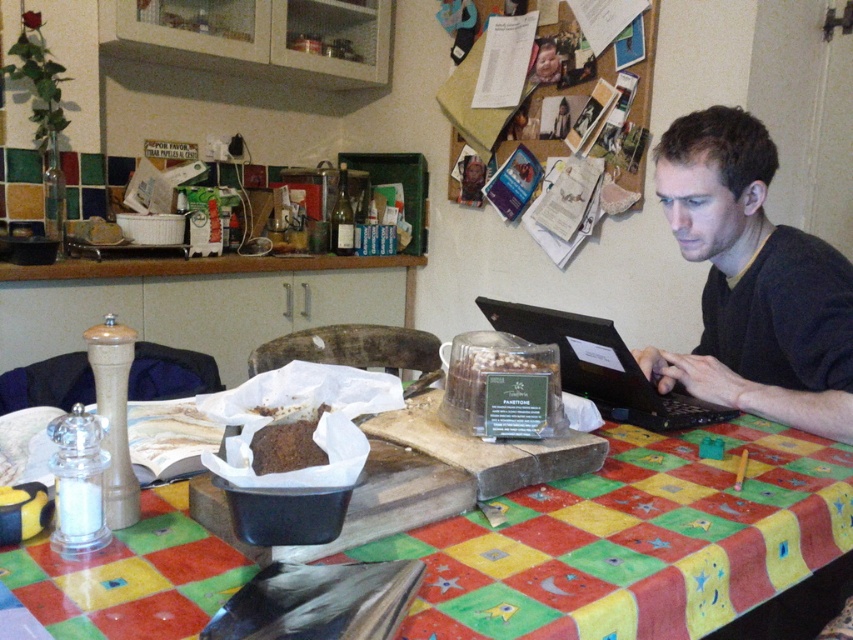
Can you confirm if dark gray sweater at right is thinner than black plastic laptop at center?

Yes.

Does dark gray sweater at right come in front of black plastic laptop at center?

No, dark gray sweater at right is further to the viewer.

Is point (737, 369) positioned behind point (612, 403)?

That is True.

Locate an element on the screen. dark gray sweater at right is located at coordinates (752, 282).

Measure the distance from multicolored fabric tablecloth at center to black plastic laptop at center.

multicolored fabric tablecloth at center and black plastic laptop at center are 11.73 inches apart from each other.

From the picture: Who is higher up, multicolored fabric tablecloth at center or black plastic laptop at center?

black plastic laptop at center is above.

Who is more distant from viewer, [144,557] or [572,388]?

Positioned behind is point [572,388].

Where is `multicolored fabric tablecloth at center`? multicolored fabric tablecloth at center is located at coordinates (635, 540).

Is black plastic laptop at center to the right of brown matte bread at center from the viewer's perspective?

Correct, you'll find black plastic laptop at center to the right of brown matte bread at center.

Does black plastic laptop at center have a greater width compared to brown matte bread at center?

Indeed, black plastic laptop at center has a greater width compared to brown matte bread at center.

I want to click on black plastic laptop at center, so click(x=601, y=368).